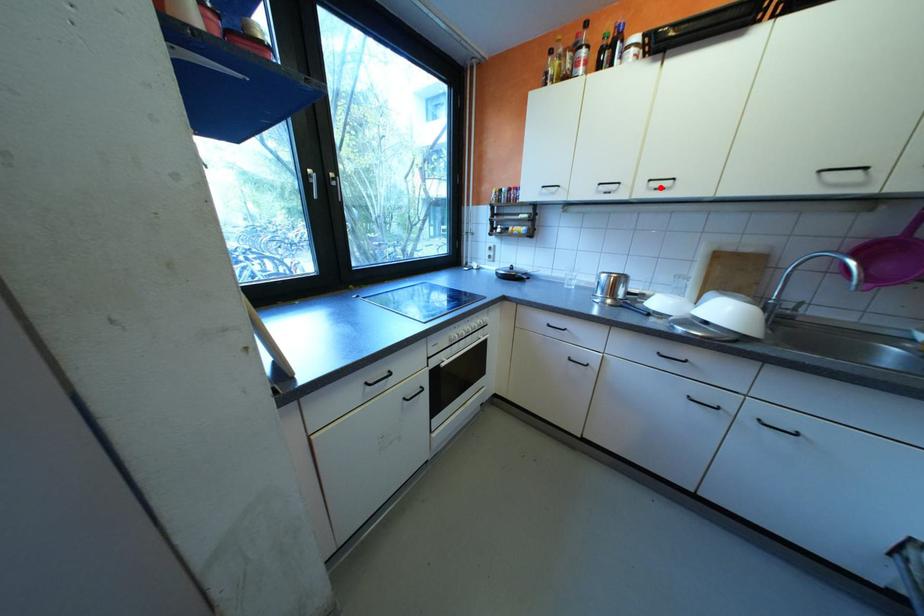
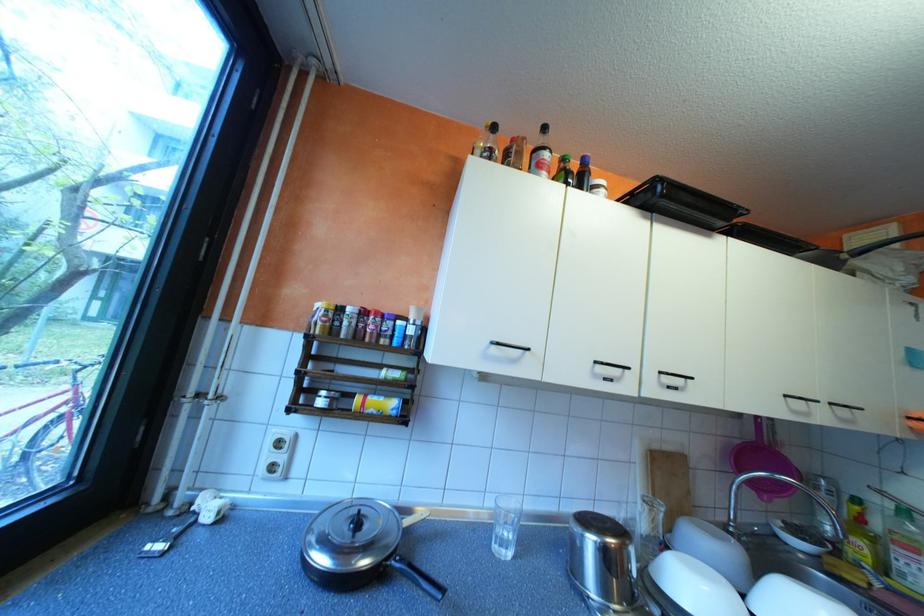
Locate, in the second image, the point that corresponds to the highlighted location in the first image.

(673, 383)